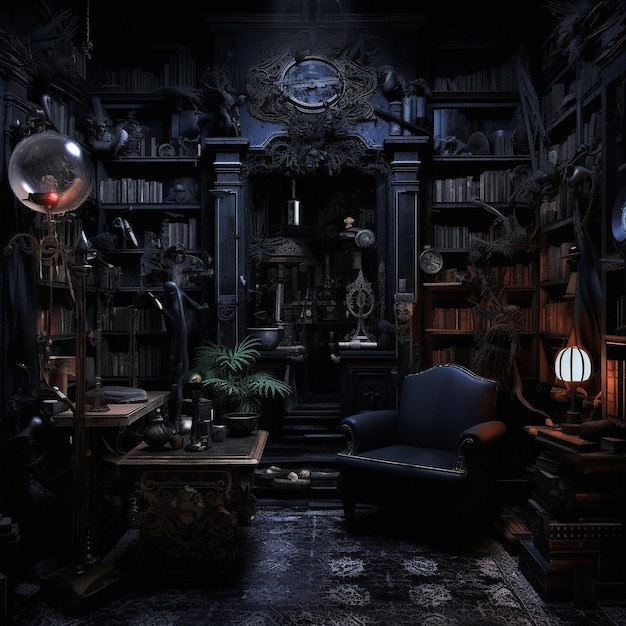
At what (x,y) coordinates should I click in order to perform the action: click on clock. Please return your answer as a coordinate pair (x, y). The image size is (626, 626). Looking at the image, I should click on (431, 262), (320, 83).